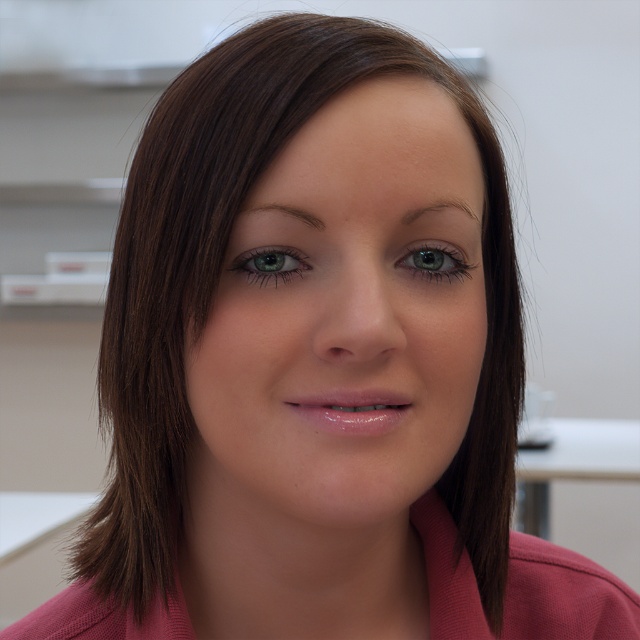
You are a photographer adjusting the focus on a camera. The subject has a smooth skin face at center and a green glossy eye at center. Which part should you focus on to ensure the face is sharp?

The smooth skin face at center is in front of the green glossy eye at center, so focusing on the smooth skin face at center will ensure the face is sharp.

You are a photographer adjusting the lighting for a portrait. You notice the subject has two eyes, the green matte eye at center and the green glossy eye at center. Considering their sizes, which eye might require more careful lighting to avoid overexposure?

The green matte eye at center has a larger width than the green glossy eye at center, so it might require more careful lighting to avoid overexposure due to its size.